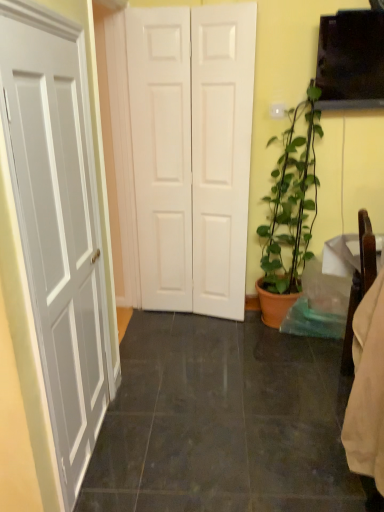
At what (x,y) coordinates should I click in order to perform the action: click on free space above black glossy tile at center (from a real-world perspective). Please return your answer as a coordinate pair (x, y). This screenshot has height=512, width=384. Looking at the image, I should click on (240, 383).